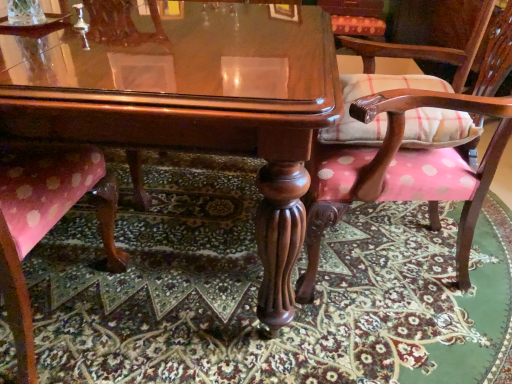
Question: Is glossy wood table at center located within pink polka dot fabric at lower center?

Choices:
 (A) yes
 (B) no

Answer: (B)

Question: Can you confirm if pink polka dot fabric at lower center is thinner than glossy wood table at center?

Choices:
 (A) yes
 (B) no

Answer: (B)

Question: From a real-world perspective, does pink polka dot fabric at lower center sit lower than glossy wood table at center?

Choices:
 (A) yes
 (B) no

Answer: (A)

Question: From a real-world perspective, is pink polka dot fabric at lower center over glossy wood table at center?

Choices:
 (A) no
 (B) yes

Answer: (A)

Question: Does pink polka dot fabric at lower center lie in front of glossy wood table at center?

Choices:
 (A) yes
 (B) no

Answer: (B)

Question: Can you confirm if pink polka dot fabric at lower center is shorter than glossy wood table at center?

Choices:
 (A) yes
 (B) no

Answer: (A)

Question: Is the position of plaid fabric cushion at upper right, the third chair viewed from the front, more distant than that of glossy wood table at center?

Choices:
 (A) no
 (B) yes

Answer: (B)

Question: From a real-world perspective, is plaid fabric cushion at upper right, the third chair positioned from the left, physically above glossy wood table at center?

Choices:
 (A) no
 (B) yes

Answer: (B)

Question: Is plaid fabric cushion at upper right, the third chair viewed from the front, closer to the viewer compared to glossy wood table at center?

Choices:
 (A) yes
 (B) no

Answer: (B)

Question: From the image's perspective, is plaid fabric cushion at upper right, the third chair viewed from the front, on glossy wood table at center?

Choices:
 (A) yes
 (B) no

Answer: (A)

Question: Is plaid fabric cushion at upper right, the third chair positioned from the left, positioned with its back to glossy wood table at center?

Choices:
 (A) no
 (B) yes

Answer: (A)

Question: Is plaid fabric cushion at upper right, the third chair viewed from the front, to the left of glossy wood table at center from the viewer's perspective?

Choices:
 (A) no
 (B) yes

Answer: (A)

Question: Considering the relative sizes of pink polka dot fabric at lower center and pink polka dot fabric chair at center, the 2th chair in the front-to-back sequence, in the image provided, is pink polka dot fabric at lower center wider than pink polka dot fabric chair at center, the 2th chair in the front-to-back sequence,?

Choices:
 (A) no
 (B) yes

Answer: (B)